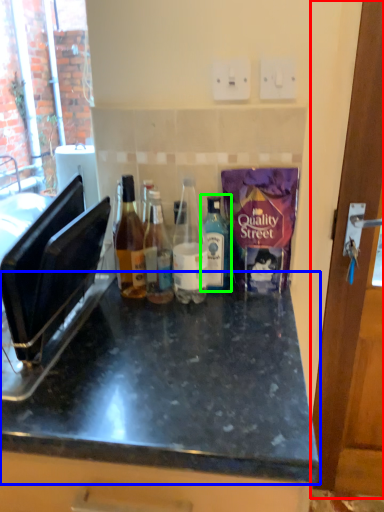
Question: Estimate the real-world distances between objects in this image. Which object is closer to door (highlighted by a red box), countertop (highlighted by a blue box) or bottle (highlighted by a green box)?

Choices:
 (A) countertop
 (B) bottle

Answer: (B)